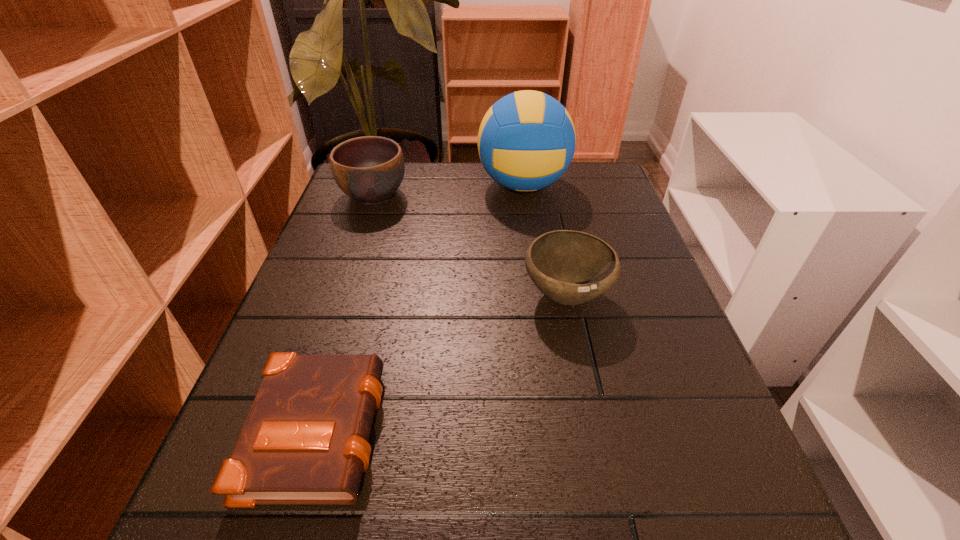
Locate an element on the screen. vacant area that lies between the Bible and the left bowl is located at coordinates coord(347,310).

The image size is (960, 540). Identify the location of vacant space that is in between the nearest object and the tallest object. (421, 306).

Locate an element on the screen. empty location between the left bowl and the volleyball is located at coordinates (448, 190).

Locate an element on the screen. The image size is (960, 540). vacant space that's between the nearest object and the nearer bowl is located at coordinates pos(443,361).

Identify the location of free space between the farther bowl and the volleyball. (448, 190).

Locate which object ranks third in proximity to the second tallest object. Please provide its 2D coordinates. Your answer should be formatted as a tuple, i.e. [(x, y)], where the tuple contains the x and y coordinates of a point satisfying the conditions above.

[(305, 440)]

Point out which object is positioned as the third nearest to the shortest object. Please provide its 2D coordinates. Your answer should be formatted as a tuple, i.e. [(x, y)], where the tuple contains the x and y coordinates of a point satisfying the conditions above.

[(526, 141)]

Locate an element on the screen. Image resolution: width=960 pixels, height=540 pixels. free space in the image that satisfies the following two spatial constraints: 1. on the front side of the volleyball; 2. on the spine side of the shortest object is located at coordinates (557, 427).